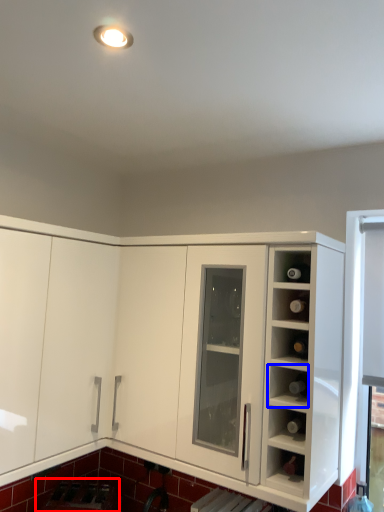
Question: Which object is closer to the camera taking this photo, appliance (highlighted by a red box) or shelf (highlighted by a blue box)?

Choices:
 (A) appliance
 (B) shelf

Answer: (B)